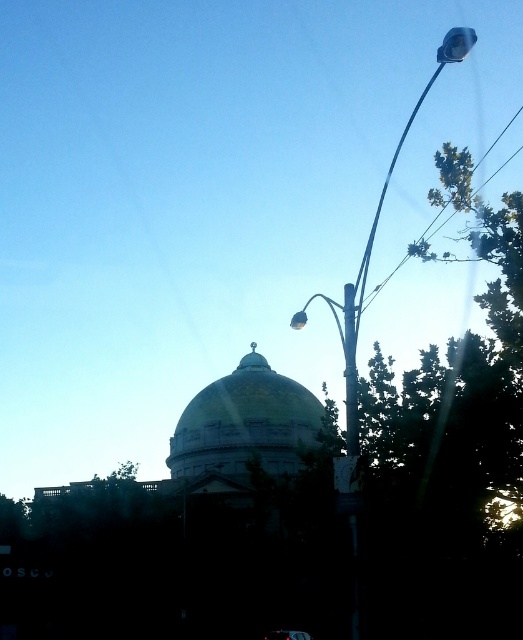
Looking at this image, is gold/yellow dome at center below metallic silver street light at upper right?

Indeed, gold/yellow dome at center is positioned under metallic silver street light at upper right.

Is gold/yellow dome at center thinner than metallic silver street light at upper right?

Indeed, gold/yellow dome at center has a lesser width compared to metallic silver street light at upper right.

At what (x,y) coordinates should I click in order to perform the action: click on gold/yellow dome at center. Please return your answer as a coordinate pair (x, y). This screenshot has height=640, width=523. Looking at the image, I should click on (245, 422).

Which is more to the right, gold/yellow dome at center or metallic pole at right?

From the viewer's perspective, metallic pole at right appears more on the right side.

Which is in front, point (235, 422) or point (346, 328)?

Point (346, 328) is more forward.

Is point (266, 429) positioned in front of point (350, 304)?

That is False.

Locate an element on the screen. The image size is (523, 640). gold/yellow dome at center is located at coordinates (245, 422).

Between point (349, 380) and point (281, 632), which one is positioned in front?

Point (349, 380) is more forward.

Does metallic silver street light at upper right appear under shiny black car at center?

No, metallic silver street light at upper right is not below shiny black car at center.

This screenshot has width=523, height=640. Find the location of `metallic silver street light at upper right`. metallic silver street light at upper right is located at coordinates (370, 252).